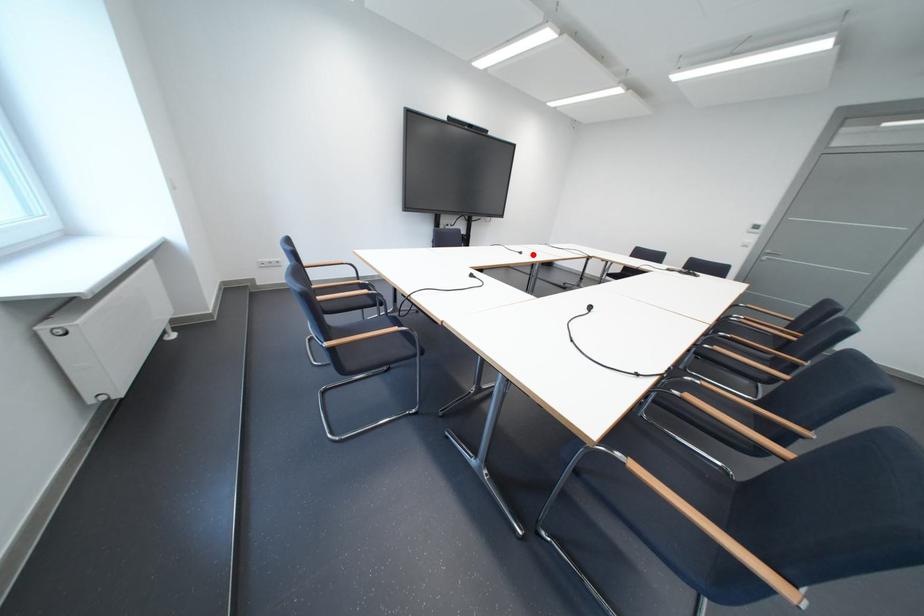
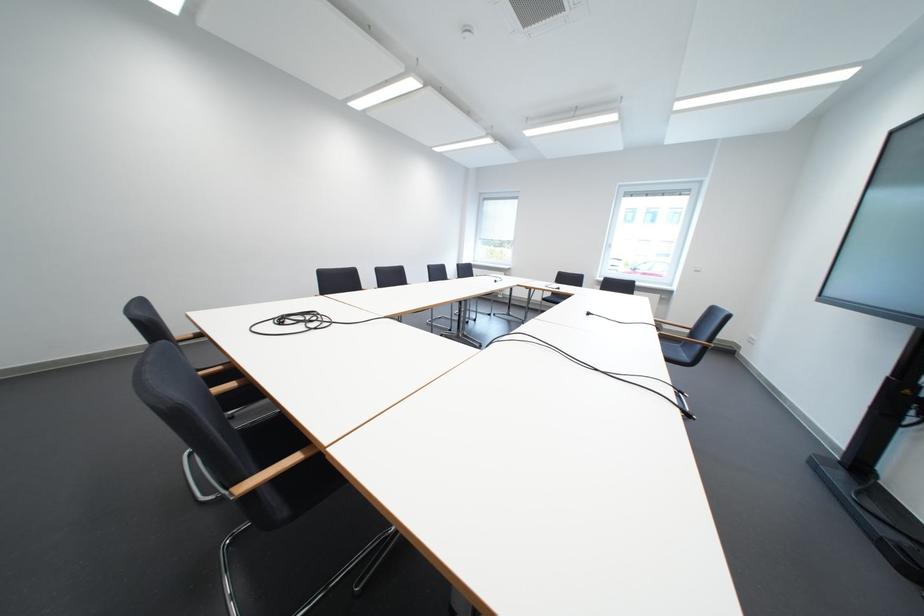
Question: I am providing you with two images of the same scene from different viewpoints. In image1, a red point is highlighted. Considering the same 3D point in image2, which of the following is correct?

Choices:
 (A) It is closer
 (B) It is farther

Answer: (A)